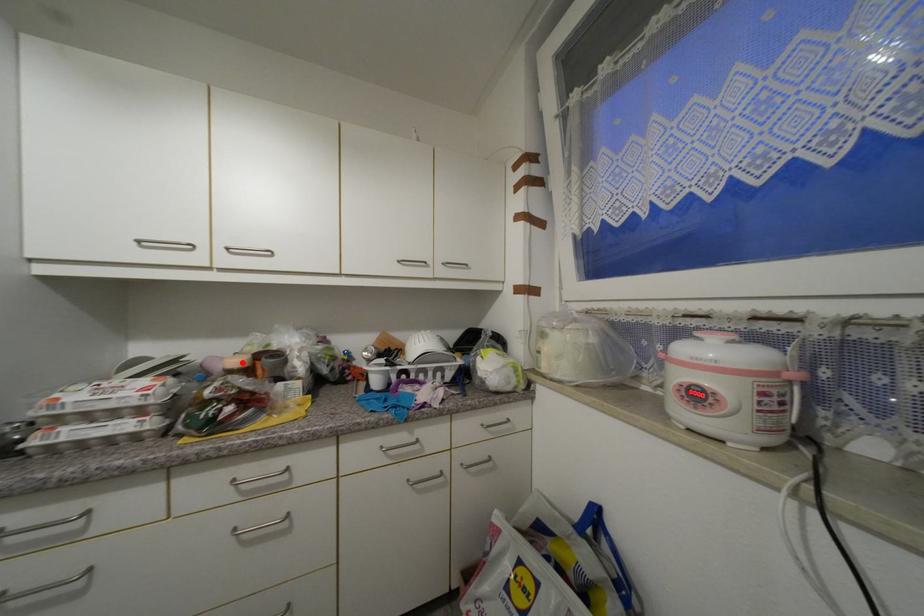
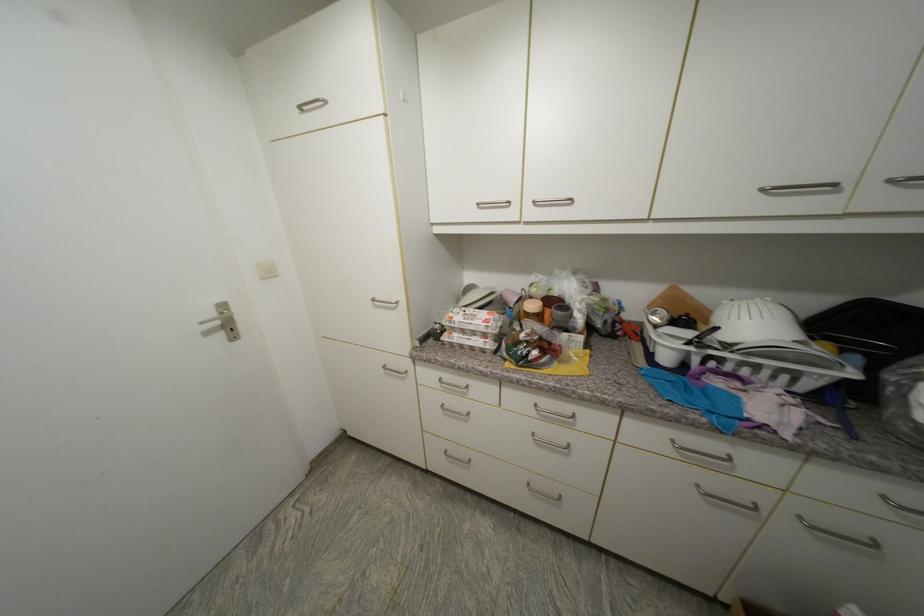
Question: I am providing you with two images of the same scene from different viewpoints. A red point is marked on the first image. Is the red point's position out of view in image 2?

Choices:
 (A) Yes
 (B) No

Answer: (B)